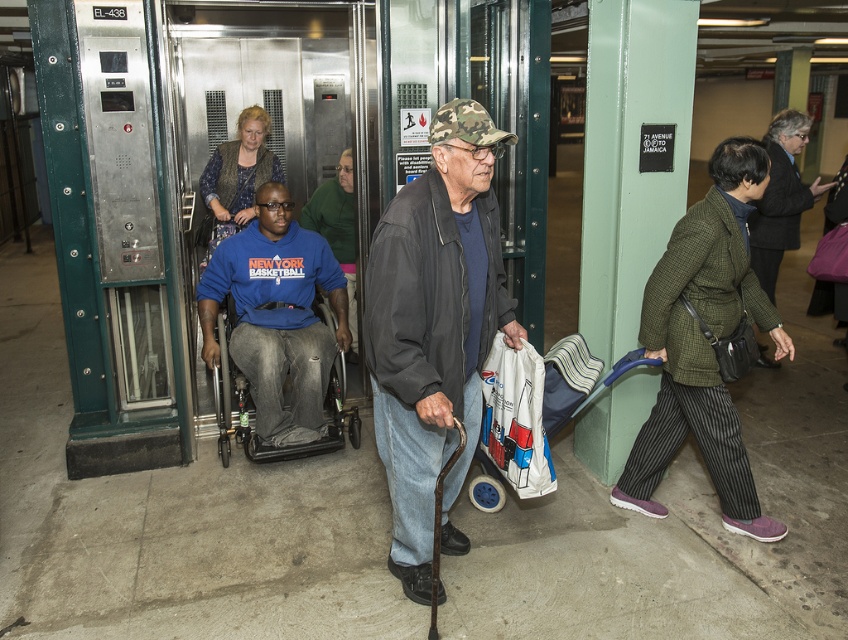
Question: Is blue cotton shirt at center to the right of white plastic bag at center from the viewer's perspective?

Choices:
 (A) no
 (B) yes

Answer: (A)

Question: Among these points, which one is nearest to the camera?

Choices:
 (A) (266, 202)
 (B) (526, 493)

Answer: (B)

Question: Based on their relative distances, which object is nearer to the blue cotton shirt at center?

Choices:
 (A) camouflage fabric cap at center
 (B) white plastic bag at center

Answer: (B)

Question: Can you confirm if camouflage fabric cap at center is positioned below blue cotton shirt at center?

Choices:
 (A) no
 (B) yes

Answer: (B)

Question: Does camouflage fabric cap at center have a smaller size compared to white plastic bag at center?

Choices:
 (A) no
 (B) yes

Answer: (A)

Question: Considering the real-world distances, which object is closest to the white plastic bag at center?

Choices:
 (A) camouflage fabric cap at center
 (B) blue cotton shirt at center

Answer: (A)